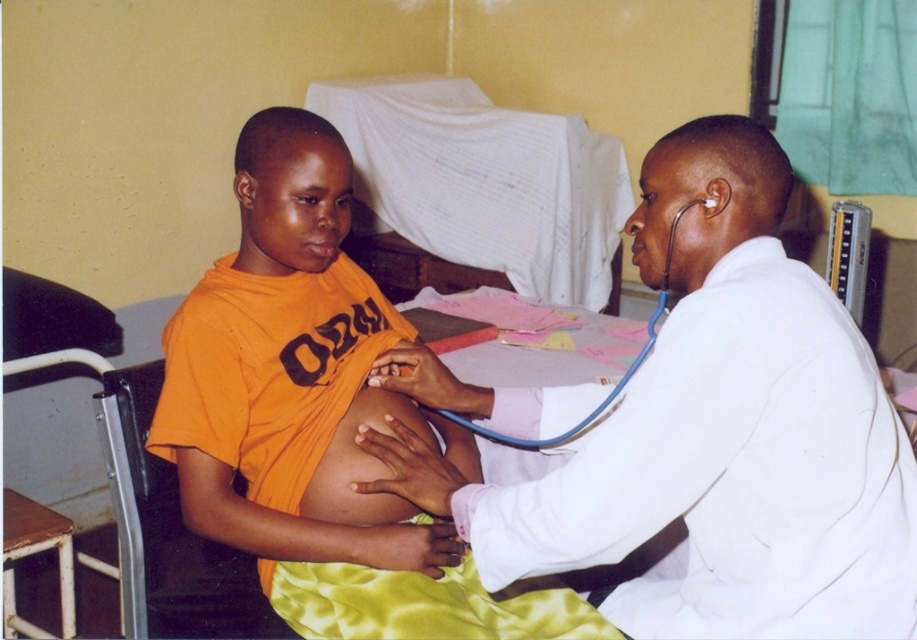
You are a medical student observing a checkup. You notice the white smooth coat at upper right and the blue rubber stethoscope at upper right. Which object is closer to you in the image?

The white smooth coat at upper right is closer to you because it is in front of the blue rubber stethoscope at upper right.

You are a medical student observing a checkup. The doctor is wearing the white smooth coat at upper right, and the patient is wearing the orange cotton shirt at center. Which clothing item has a shorter length?

The white smooth coat at upper right is shorter than the orange cotton shirt at center.